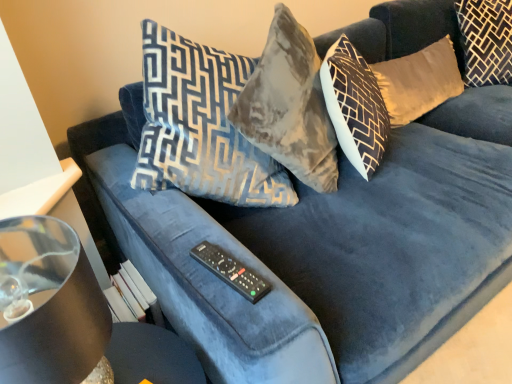
Question: Is black plastic remote at center turned away from velvet gold pillow at upper right, placed as the 2th pillow when sorted from right to left?

Choices:
 (A) yes
 (B) no

Answer: (B)

Question: Considering the relative sizes of black plastic remote at center and velvet gold pillow at upper right, the 1th pillow from the left, in the image provided, is black plastic remote at center smaller than velvet gold pillow at upper right, the 1th pillow from the left,?

Choices:
 (A) no
 (B) yes

Answer: (B)

Question: Is black plastic remote at center positioned far away from velvet gold pillow at upper right, the 1th pillow from the left?

Choices:
 (A) no
 (B) yes

Answer: (B)

Question: From a real-world perspective, does black plastic remote at center sit lower than velvet gold pillow at upper right, placed as the 2th pillow when sorted from right to left?

Choices:
 (A) yes
 (B) no

Answer: (B)

Question: Considering the relative sizes of black plastic remote at center and velvet gold pillow at upper right, placed as the 2th pillow when sorted from right to left, in the image provided, is black plastic remote at center thinner than velvet gold pillow at upper right, placed as the 2th pillow when sorted from right to left,?

Choices:
 (A) no
 (B) yes

Answer: (A)

Question: From the image's perspective, is velvet gold pillow at upper right, the 1th pillow from the left, positioned above or below velvet gold pillow at upper right, the second pillow positioned from the left?

Choices:
 (A) below
 (B) above

Answer: (A)

Question: Is velvet gold pillow at upper right, the 1th pillow from the left, wider or thinner than velvet gold pillow at upper right, the second pillow positioned from the left?

Choices:
 (A) wide
 (B) thin

Answer: (B)

Question: Looking at the image, does velvet gold pillow at upper right, placed as the 2th pillow when sorted from right to left, seem bigger or smaller compared to velvet gold pillow at upper right, the 1th pillow from the right?

Choices:
 (A) big
 (B) small

Answer: (B)

Question: From a real-world perspective, is velvet gold pillow at upper right, placed as the 2th pillow when sorted from right to left, positioned above or below velvet gold pillow at upper right, the 1th pillow from the right?

Choices:
 (A) below
 (B) above

Answer: (A)

Question: From a real-world perspective, is black plastic remote at center physically located above or below shiny black lampshade at left?

Choices:
 (A) above
 (B) below

Answer: (B)

Question: Is black plastic remote at center bigger or smaller than shiny black lampshade at left?

Choices:
 (A) small
 (B) big

Answer: (A)

Question: Relative to shiny black lampshade at left, is black plastic remote at center in front or behind?

Choices:
 (A) behind
 (B) front

Answer: (A)

Question: Is point (252, 284) closer or farther from the camera than point (101, 374)?

Choices:
 (A) closer
 (B) farther

Answer: (B)

Question: Is velvet gold pillow at upper right, the second pillow positioned from the left, spatially inside transparent glass table at lower left, or outside of it?

Choices:
 (A) inside
 (B) outside

Answer: (B)

Question: Considering their positions, is velvet gold pillow at upper right, the 1th pillow from the right, located in front of or behind transparent glass table at lower left?

Choices:
 (A) front
 (B) behind

Answer: (B)